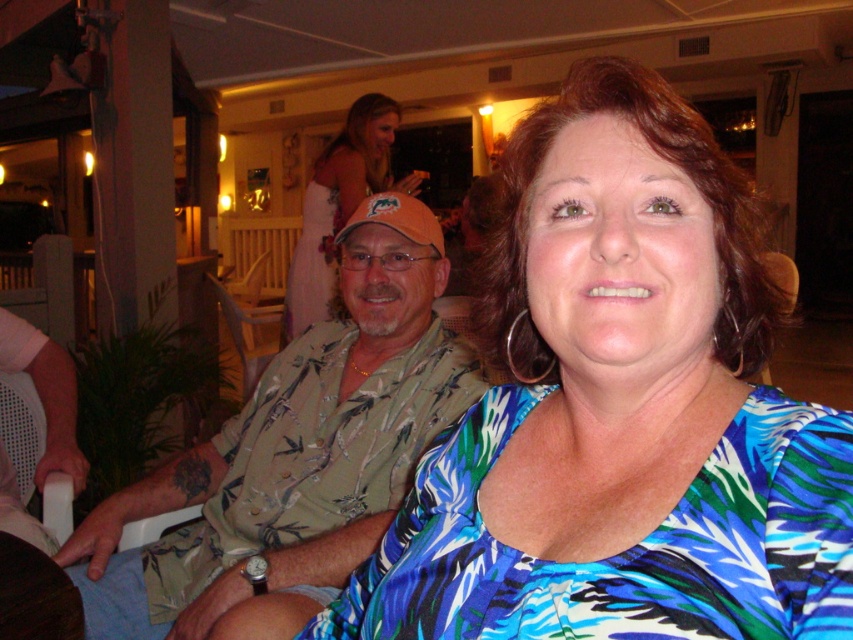
Question: Is blue printed blouse at center smaller than matte orange cap at center?

Choices:
 (A) yes
 (B) no

Answer: (A)

Question: Does blue printed blouse at center appear over matte orange cap at center?

Choices:
 (A) yes
 (B) no

Answer: (B)

Question: Can you confirm if green floral shirt at left is positioned to the left of matte orange cap at center?

Choices:
 (A) no
 (B) yes

Answer: (A)

Question: Among these points, which one is farthest from the camera?

Choices:
 (A) (332, 234)
 (B) (320, 609)

Answer: (A)

Question: Which of the following is the closest to the observer?

Choices:
 (A) matte orange cap at center
 (B) blue printed blouse at center
 (C) green floral shirt at left

Answer: (B)

Question: Which point is farther from the camera taking this photo?

Choices:
 (A) (309, 216)
 (B) (334, 483)

Answer: (A)